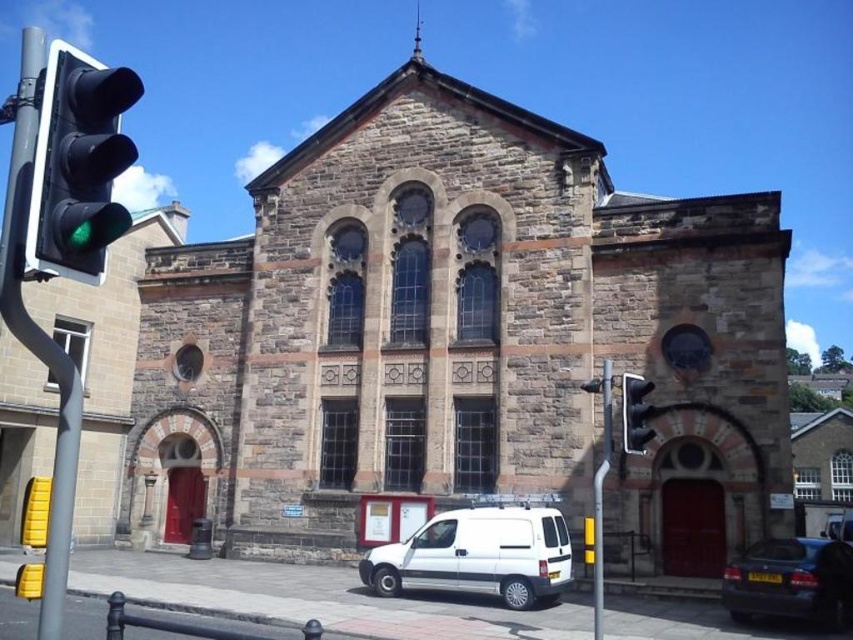
In the scene shown: Can you confirm if brown stone church at center is smaller than white matte van at center?

Incorrect, brown stone church at center is not smaller in size than white matte van at center.

Is point (660, 480) farther from viewer compared to point (440, 573)?

That is True.

Identify the location of brown stone church at center. (460, 342).

This screenshot has width=853, height=640. What do you see at coordinates (479, 556) in the screenshot?
I see `white matte van at center` at bounding box center [479, 556].

Does point (436, 566) come behind point (747, 596)?

That is True.

Who is more distant from viewer, (374, 572) or (817, 596)?

Point (374, 572)

This screenshot has height=640, width=853. I want to click on white matte van at center, so click(x=479, y=556).

How far apart are shiny black car at lower right and metallic traffic light at right?

shiny black car at lower right is 40.46 feet away from metallic traffic light at right.

Does shiny black car at lower right have a smaller size compared to metallic traffic light at right?

Yes, shiny black car at lower right is smaller than metallic traffic light at right.

The width and height of the screenshot is (853, 640). Find the location of `shiny black car at lower right`. shiny black car at lower right is located at coordinates (791, 580).

Locate an element on the screen. Image resolution: width=853 pixels, height=640 pixels. shiny black car at lower right is located at coordinates (791, 580).